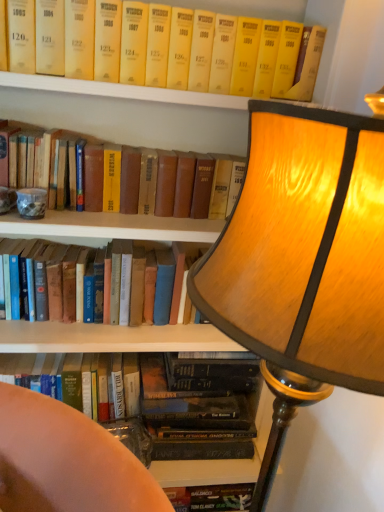
Question: Is yellow hardcover book at upper center, which appears as the 3th book when ordered from the bottom, surrounded by yellow paperback book at upper center, which appears as the 4th book when ordered from the bottom?

Choices:
 (A) yes
 (B) no

Answer: (B)

Question: Is yellow paperback book at upper center, the 1th book when ordered from top to bottom, directly adjacent to yellow hardcover book at upper center, which appears as the 3th book when ordered from the bottom?

Choices:
 (A) yes
 (B) no

Answer: (B)

Question: Does yellow paperback book at upper center, the 1th book when ordered from top to bottom, come in front of yellow hardcover book at upper center, which appears as the 3th book when ordered from the bottom?

Choices:
 (A) yes
 (B) no

Answer: (A)

Question: Is yellow paperback book at upper center, the 1th book when ordered from top to bottom, not close to yellow hardcover book at upper center, which appears as the 3th book when ordered from the bottom?

Choices:
 (A) no
 (B) yes

Answer: (A)

Question: From the image's perspective, is yellow paperback book at upper center, the 1th book when ordered from top to bottom, over yellow hardcover book at upper center, marked as the 2th book in a top-to-bottom arrangement?

Choices:
 (A) yes
 (B) no

Answer: (A)

Question: In the image, is hardcover book at lower left, which is the 1th book in bottom-to-top order, on the left side or the right side of yellow hardcover book at upper center, which appears as the 3th book when ordered from the bottom?

Choices:
 (A) left
 (B) right

Answer: (A)

Question: In the image, is hardcover book at lower left, the fourth book when ordered from top to bottom, positioned in front of or behind yellow hardcover book at upper center, which appears as the 3th book when ordered from the bottom?

Choices:
 (A) front
 (B) behind

Answer: (B)

Question: From a real-world perspective, relative to yellow hardcover book at upper center, marked as the 2th book in a top-to-bottom arrangement, is hardcover book at lower left, the fourth book when ordered from top to bottom, vertically above or below?

Choices:
 (A) above
 (B) below

Answer: (B)

Question: Looking at the image, does hardcover book at lower left, which is the 1th book in bottom-to-top order, seem bigger or smaller compared to yellow hardcover book at upper center, marked as the 2th book in a top-to-bottom arrangement?

Choices:
 (A) small
 (B) big

Answer: (A)

Question: In terms of width, does hardcover book at lower left, which is the 1th book in bottom-to-top order, look wider or thinner when compared to yellow paperback book at upper center, which appears as the 4th book when ordered from the bottom?

Choices:
 (A) thin
 (B) wide

Answer: (A)

Question: Is point (119, 360) positioned closer to the camera than point (223, 59)?

Choices:
 (A) closer
 (B) farther

Answer: (B)

Question: Is hardcover book at lower left, the fourth book when ordered from top to bottom, to the left or to the right of yellow paperback book at upper center, which appears as the 4th book when ordered from the bottom, in the image?

Choices:
 (A) right
 (B) left

Answer: (B)

Question: From the image's perspective, relative to yellow paperback book at upper center, the 1th book when ordered from top to bottom, is hardcover book at lower left, which is the 1th book in bottom-to-top order, above or below?

Choices:
 (A) below
 (B) above

Answer: (A)

Question: Considering the positions of yellow paperback book at upper center, the 1th book when ordered from top to bottom, and hardcover book at left, which is the third book in top-to-bottom order, in the image, is yellow paperback book at upper center, the 1th book when ordered from top to bottom, bigger or smaller than hardcover book at left, which is the third book in top-to-bottom order,?

Choices:
 (A) small
 (B) big

Answer: (A)

Question: Is point (201, 74) positioned closer to the camera than point (69, 251)?

Choices:
 (A) closer
 (B) farther

Answer: (A)